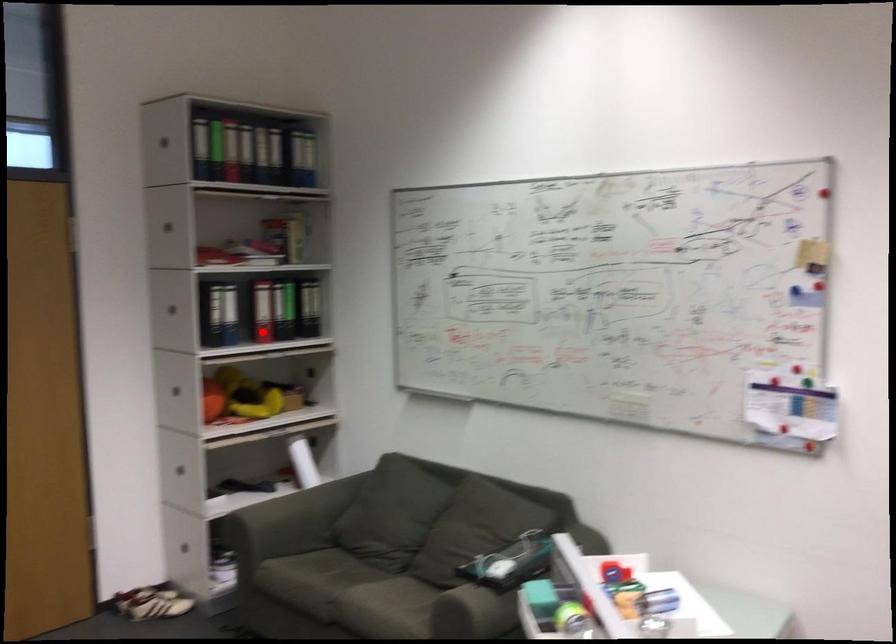
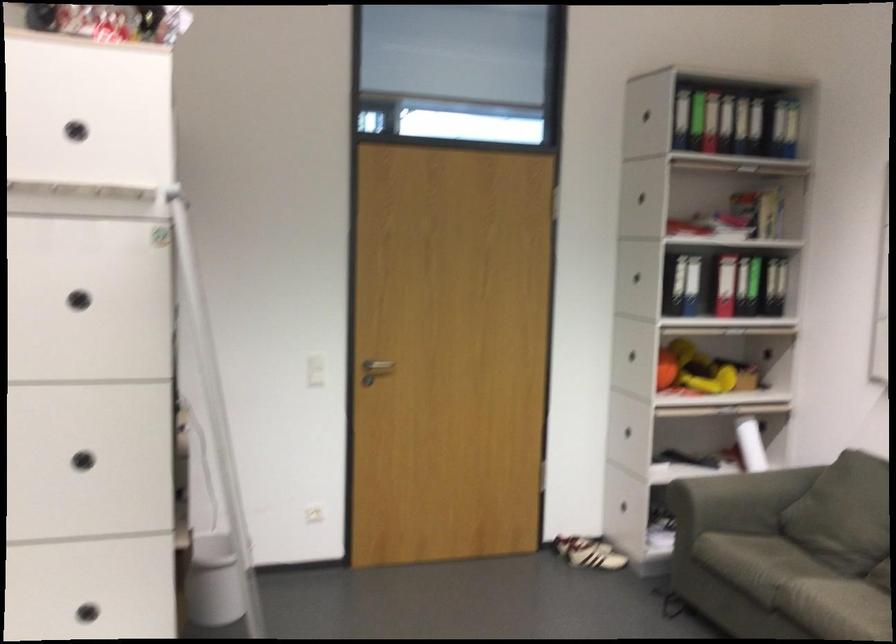
Question: I am providing you with two images of the same scene from different viewpoints. Image1 has a red point marked. In image2, the corresponding 3D location appears at what relative position? Reply with the corresponding letter.

Choices:
 (A) Closer
 (B) Farther

Answer: (A)